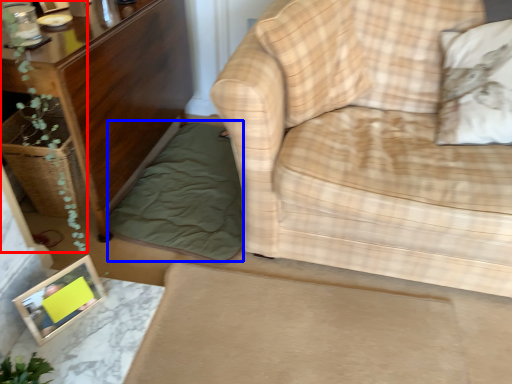
Question: Which point is further to the camera, plant (highlighted by a red box) or bedding (highlighted by a blue box)?

Choices:
 (A) plant
 (B) bedding

Answer: (B)